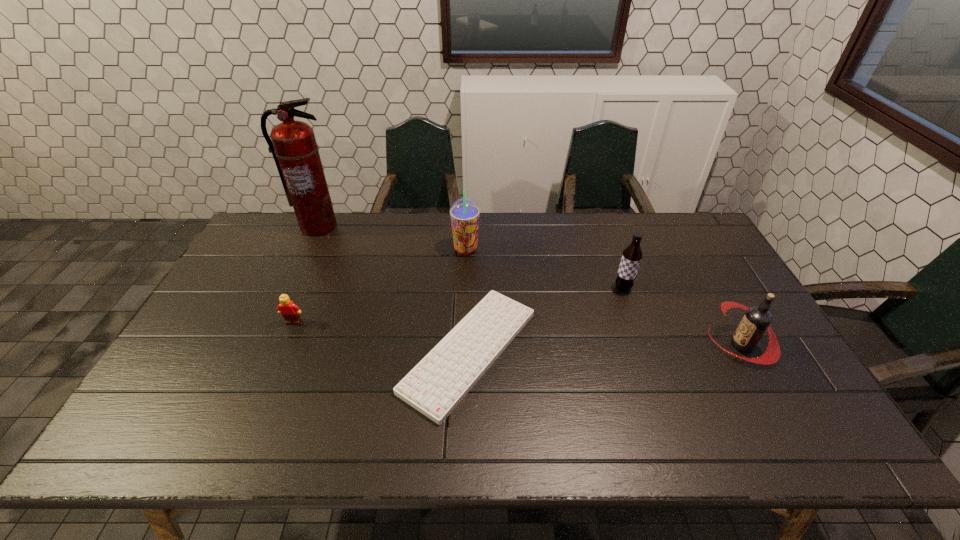
Locate an element on the screen. This screenshot has width=960, height=540. vacant space located 0.140m on the back of the fifth nearest object is located at coordinates (467, 218).

At what (x,y) coordinates should I click in order to perform the action: click on vacant space located 0.330m on the front of the left root beer. Please return your answer as a coordinate pair (x, y). Looking at the image, I should click on (658, 388).

Where is `free space located 0.270m on the label of the rightmost object`? This screenshot has height=540, width=960. free space located 0.270m on the label of the rightmost object is located at coordinates (612, 345).

This screenshot has height=540, width=960. Find the location of `vacant space located 0.300m on the label of the rightmost object`. vacant space located 0.300m on the label of the rightmost object is located at coordinates (600, 345).

The width and height of the screenshot is (960, 540). Find the location of `free space located 0.340m on the label of the rightmost object`. free space located 0.340m on the label of the rightmost object is located at coordinates (586, 345).

You are a GUI agent. You are given a task and a screenshot of the screen. Output one action in this format:
    pyautogui.click(x=<x>, y=<y>)
    Task: Click on the vacant space located 0.050m on the face of the fifth tallest object
    The height and width of the screenshot is (540, 960).
    Given the screenshot: What is the action you would take?
    pyautogui.click(x=286, y=339)

Identify the location of blank space located on the right of the computer keyboard. (684, 351).

I want to click on fire extinguisher that is at the far edge, so click(295, 151).

You are a GUI agent. You are given a task and a screenshot of the screen. Output one action in this format:
    pyautogui.click(x=<x>, y=<y>)
    Task: Click on the smoothie present at the far edge
    
    Given the screenshot: What is the action you would take?
    pyautogui.click(x=464, y=213)

Where is `object present at the near edge`? Image resolution: width=960 pixels, height=540 pixels. object present at the near edge is located at coordinates (436, 385).